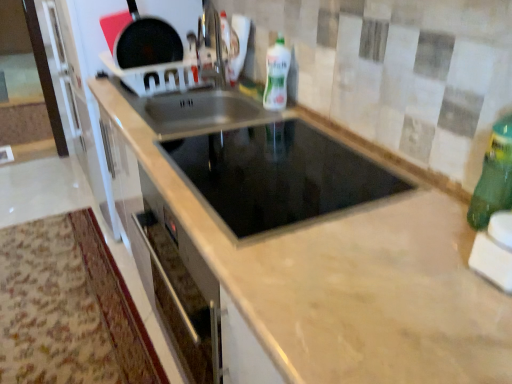
Describe the element at coordinates (146, 42) in the screenshot. I see `shiny black frying pan at upper left` at that location.

What is the approximate width of beige marble countertop at center?

It is 26.29 inches.

The width and height of the screenshot is (512, 384). Describe the element at coordinates (330, 261) in the screenshot. I see `beige marble countertop at center` at that location.

This screenshot has width=512, height=384. What do you see at coordinates (276, 75) in the screenshot? I see `white glossy bottle at upper center, marked as the first bottle in a back-to-front arrangement` at bounding box center [276, 75].

The image size is (512, 384). I want to click on shiny black frying pan at upper left, so click(x=146, y=42).

Is green plastic bottle at right, which ranks as the second bottle in top-to-bottom order, at the right side of black glass cooktop at center?

Yes.

Is green plastic bottle at right, positioned as the 2th bottle in back-to-front order, looking in the opposite direction of black glass cooktop at center?

No, green plastic bottle at right, positioned as the 2th bottle in back-to-front order,'s orientation is not away from black glass cooktop at center.

Measure the distance between green plastic bottle at right, placed as the 1th bottle when sorted from right to left, and black glass cooktop at center.

The distance of green plastic bottle at right, placed as the 1th bottle when sorted from right to left, from black glass cooktop at center is 16.44 inches.

Is point (487, 224) closer to viewer compared to point (305, 219)?

That is True.

This screenshot has height=384, width=512. In order to click on frying pan on the left side of beige marble countertop at center in this screenshot , I will do `click(146, 42)`.

In terms of height, does shiny black frying pan at upper left look taller or shorter compared to beige marble countertop at center?

Considering their sizes, shiny black frying pan at upper left has less height than beige marble countertop at center.

Who is bigger, shiny black frying pan at upper left or beige marble countertop at center?

beige marble countertop at center is bigger.

Considering the positions of objects shiny black frying pan at upper left and beige marble countertop at center in the image provided, who is in front, shiny black frying pan at upper left or beige marble countertop at center?

beige marble countertop at center.

Is beige marble countertop at center oriented away from black glass cooktop at center?

beige marble countertop at center does not have its back to black glass cooktop at center.

At what (x,y) coordinates should I click in order to perform the action: click on appliance above the beige marble countertop at center (from a real-world perspective). Please return your answer as a coordinate pair (x, y). This screenshot has width=512, height=384. Looking at the image, I should click on (279, 175).

Considering the relative sizes of beige marble countertop at center and black glass cooktop at center in the image provided, is beige marble countertop at center smaller than black glass cooktop at center?

No.

Which object is more forward, beige marble countertop at center or black glass cooktop at center?

beige marble countertop at center is more forward.

Based on their positions, is shiny black frying pan at upper left located to the left or right of white glossy bottle at upper center, arranged as the 2th bottle when viewed from the front?

Clearly, shiny black frying pan at upper left is on the left of white glossy bottle at upper center, arranged as the 2th bottle when viewed from the front, in the image.

Can you confirm if shiny black frying pan at upper left is smaller than white glossy bottle at upper center, the second bottle ordered from the bottom?

Actually, shiny black frying pan at upper left might be larger than white glossy bottle at upper center, the second bottle ordered from the bottom.

Would you say white glossy bottle at upper center, the first bottle from the top, is part of shiny black frying pan at upper left's contents?

No, shiny black frying pan at upper left does not contain white glossy bottle at upper center, the first bottle from the top.

From a real-world perspective, is shiny black frying pan at upper left located beneath white glossy bottle at upper center, marked as the first bottle in a back-to-front arrangement?

Actually, shiny black frying pan at upper left is physically above white glossy bottle at upper center, marked as the first bottle in a back-to-front arrangement, in the real world.

Are black glass cooktop at center and beige marble countertop at center making contact?

Answer: Yes, the surface of black glass cooktop at center is in contact with beige marble countertop at center.

Consider the image. Does black glass cooktop at center have a smaller size compared to beige marble countertop at center?

Yes, black glass cooktop at center is smaller than beige marble countertop at center.

Between black glass cooktop at center and beige marble countertop at center, which one has less height?

black glass cooktop at center is shorter.

At what (x,y) coordinates should I click in order to perform the action: click on countertop located in front of the black glass cooktop at center. Please return your answer as a coordinate pair (x, y). Image resolution: width=512 pixels, height=384 pixels. Looking at the image, I should click on (330, 261).

Considering the sizes of beige marble countertop at center and shiny black frying pan at upper left in the image, is beige marble countertop at center wider or thinner than shiny black frying pan at upper left?

Clearly, beige marble countertop at center has more width compared to shiny black frying pan at upper left.

From the image's perspective, does beige marble countertop at center appear higher than shiny black frying pan at upper left?

No, from the image's perspective, beige marble countertop at center is not on top of shiny black frying pan at upper left.

Is beige marble countertop at center next to shiny black frying pan at upper left and touching it?

No, beige marble countertop at center is not making contact with shiny black frying pan at upper left.

The image size is (512, 384). What are the coordinates of `frying pan that appears above the beige marble countertop at center (from the image's perspective)` in the screenshot? It's located at (146, 42).

Is the position of beige marble countertop at center less distant than that of green plastic bottle at right, which is the first bottle from bottom to top?

Yes, beige marble countertop at center is in front of green plastic bottle at right, which is the first bottle from bottom to top.

Can you confirm if beige marble countertop at center is shorter than green plastic bottle at right, placed as the 1th bottle when sorted from right to left?

No, beige marble countertop at center is not shorter than green plastic bottle at right, placed as the 1th bottle when sorted from right to left.

Are beige marble countertop at center and green plastic bottle at right, which is the first bottle from bottom to top, far apart?

No, beige marble countertop at center is in close proximity to green plastic bottle at right, which is the first bottle from bottom to top.

Is beige marble countertop at center inside the boundaries of green plastic bottle at right, which ranks as the second bottle in top-to-bottom order, or outside?

beige marble countertop at center is outside green plastic bottle at right, which ranks as the second bottle in top-to-bottom order.

This screenshot has width=512, height=384. Find the location of `appliance behind the green plastic bottle at right, the 1th bottle in the front-to-back sequence`. appliance behind the green plastic bottle at right, the 1th bottle in the front-to-back sequence is located at coordinates (279, 175).

Image resolution: width=512 pixels, height=384 pixels. I want to click on countertop located in front of the shiny black frying pan at upper left, so click(330, 261).

From the image, which object appears to be nearer to black glass cooktop at center, green plastic bottle at right, which appears as the 2th bottle when viewed from the left, or shiny black frying pan at upper left?

green plastic bottle at right, which appears as the 2th bottle when viewed from the left, is positioned closer to the anchor black glass cooktop at center.

Which object lies further to the anchor point shiny black frying pan at upper left, black glass cooktop at center or beige marble countertop at center?

Among the two, black glass cooktop at center is located further to shiny black frying pan at upper left.

When comparing their distances from black glass cooktop at center, does shiny black frying pan at upper left or white glossy bottle at upper center, the first bottle from the top, seem closer?

white glossy bottle at upper center, the first bottle from the top, is closer to black glass cooktop at center.

Which object lies nearer to the anchor point green plastic bottle at right, the 1th bottle in the front-to-back sequence, black glass cooktop at center or beige marble countertop at center?

black glass cooktop at center is positioned closer to the anchor green plastic bottle at right, the 1th bottle in the front-to-back sequence.

When comparing their distances from white glossy bottle at upper center, the first bottle from the top, does shiny black frying pan at upper left or black glass cooktop at center seem closer?

black glass cooktop at center.

Estimate the real-world distances between objects in this image. Which object is further from beige marble countertop at center, black glass cooktop at center or green plastic bottle at right, which appears as the 2th bottle when viewed from the left?

green plastic bottle at right, which appears as the 2th bottle when viewed from the left, is positioned further to the anchor beige marble countertop at center.

Consider the image. Which object lies nearer to the anchor point white glossy bottle at upper center, which is counted as the first bottle, starting from the left, shiny black frying pan at upper left or beige marble countertop at center?

shiny black frying pan at upper left is positioned closer to the anchor white glossy bottle at upper center, which is counted as the first bottle, starting from the left.

When comparing their distances from white glossy bottle at upper center, the second bottle ordered from the bottom, does shiny black frying pan at upper left or green plastic bottle at right, positioned as the 2th bottle in back-to-front order, seem further?

Among the two, green plastic bottle at right, positioned as the 2th bottle in back-to-front order, is located further to white glossy bottle at upper center, the second bottle ordered from the bottom.

This screenshot has width=512, height=384. In order to click on bottle located between black glass cooktop at center and shiny black frying pan at upper left in the depth direction in this screenshot , I will do `click(276, 75)`.

Locate an element on the screen. This screenshot has width=512, height=384. appliance located between beige marble countertop at center and white glossy bottle at upper center, the 2th bottle from the right, in the depth direction is located at coordinates (279, 175).

At what (x,y) coordinates should I click in order to perform the action: click on appliance between shiny black frying pan at upper left and green plastic bottle at right, positioned as the 2th bottle in back-to-front order, from left to right. Please return your answer as a coordinate pair (x, y). Looking at the image, I should click on (279, 175).

This screenshot has height=384, width=512. In order to click on appliance between beige marble countertop at center and shiny black frying pan at upper left in the front-back direction in this screenshot , I will do `click(279, 175)`.